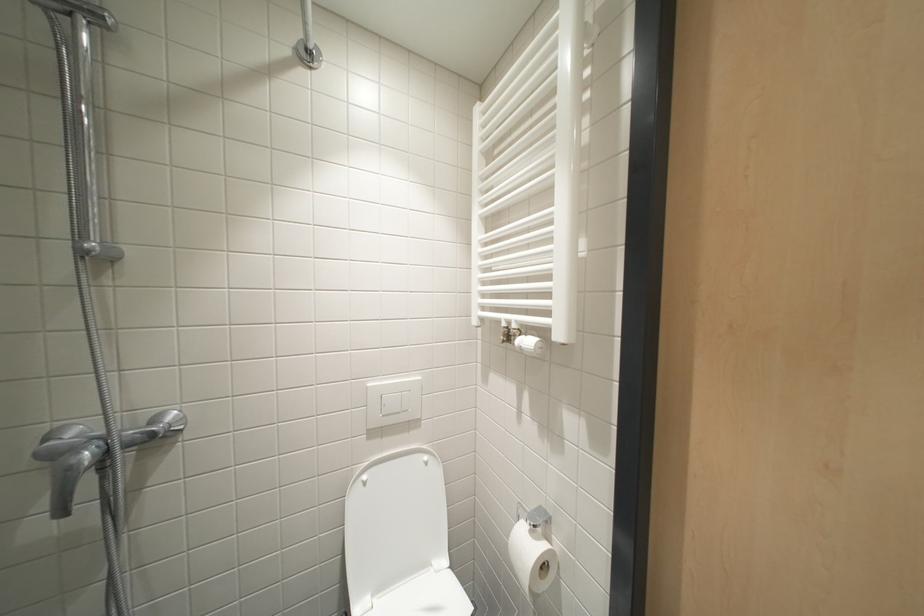
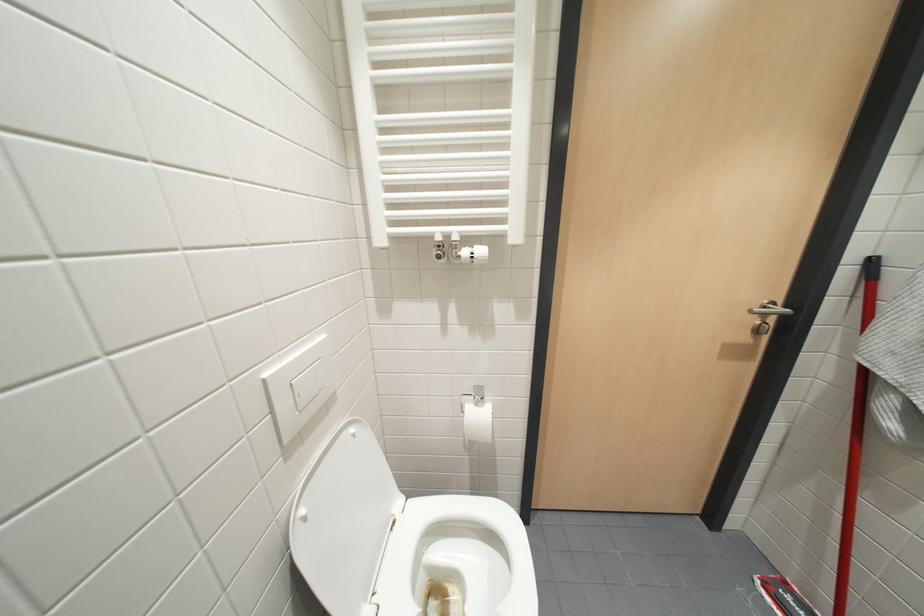
Based on the continuous images, in which direction is the camera rotating?

The camera rotated toward right-down.